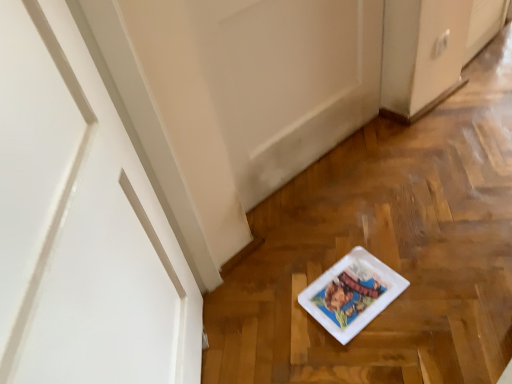
Question: Considering the relative positions of white matte door at center and white glossy platter at center in the image provided, is white matte door at center to the left of white glossy platter at center from the viewer's perspective?

Choices:
 (A) no
 (B) yes

Answer: (B)

Question: Is white matte door at center positioned with its back to white glossy platter at center?

Choices:
 (A) yes
 (B) no

Answer: (B)

Question: From the image's perspective, is white matte door at center under white glossy platter at center?

Choices:
 (A) no
 (B) yes

Answer: (A)

Question: Is white matte door at center oriented towards white glossy platter at center?

Choices:
 (A) no
 (B) yes

Answer: (B)

Question: Does white matte door at center have a greater height compared to white glossy platter at center?

Choices:
 (A) no
 (B) yes

Answer: (B)

Question: Is white matte door at center not close to white glossy platter at center?

Choices:
 (A) no
 (B) yes

Answer: (A)

Question: Is white matte door at center at the back of white glossy platter at center?

Choices:
 (A) yes
 (B) no

Answer: (B)

Question: Can you see white glossy platter at center touching white matte door at center?

Choices:
 (A) yes
 (B) no

Answer: (B)

Question: From the image's perspective, is white glossy platter at center beneath white matte door at center?

Choices:
 (A) no
 (B) yes

Answer: (B)

Question: From a real-world perspective, is white glossy platter at center positioned under white matte door at center based on gravity?

Choices:
 (A) yes
 (B) no

Answer: (A)

Question: Does white glossy platter at center have a larger size compared to white matte door at center?

Choices:
 (A) yes
 (B) no

Answer: (B)

Question: Is white glossy platter at center aimed at white matte door at center?

Choices:
 (A) yes
 (B) no

Answer: (B)

Question: From a real-world perspective, relative to white glossy platter at center, is white matte door at center vertically above or below?

Choices:
 (A) below
 (B) above

Answer: (B)